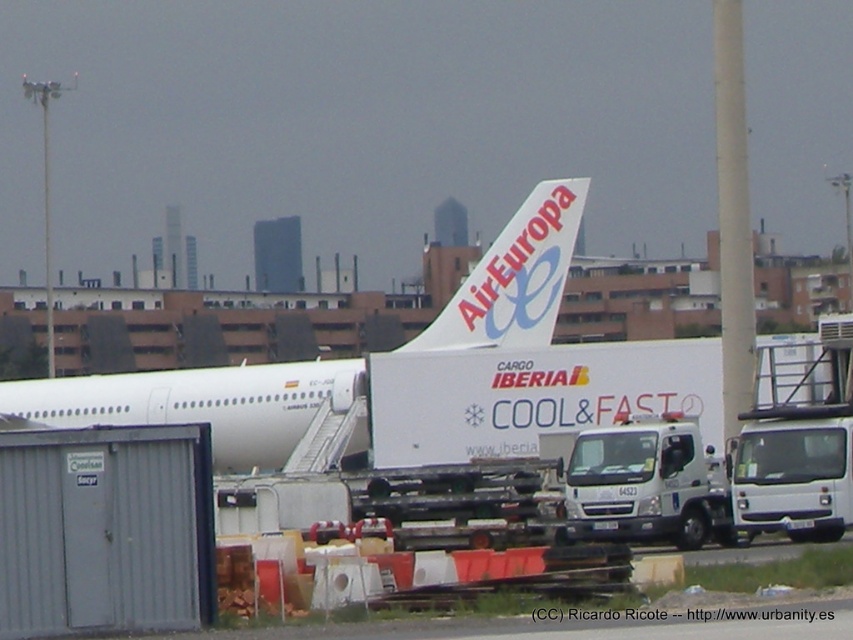
Who is higher up, white metallic truck at lower center or white matte airplane tail at center?

white matte airplane tail at center

Who is more distant from viewer, (606,476) or (563,209)?

Positioned behind is point (563,209).

In order to click on white metallic truck at lower center in this screenshot , I will do `click(645, 483)`.

Between point (498, 246) and point (653, 516), which one is positioned behind?

Point (498, 246)

Does white matte airplane at center appear on the right side of white metallic truck at lower center?

In fact, white matte airplane at center is to the left of white metallic truck at lower center.

Which is in front, point (544, 234) or point (606, 481)?

Positioned in front is point (606, 481).

Locate an element on the screen. Image resolution: width=853 pixels, height=640 pixels. white matte airplane at center is located at coordinates (198, 403).

Does white matte airplane at center have a smaller size compared to white matte airplane tail at center?

No, white matte airplane at center is not smaller than white matte airplane tail at center.

Does point (161, 403) come farther from viewer compared to point (498, 346)?

Yes, point (161, 403) is behind point (498, 346).

Is point (50, 412) closer to camera compared to point (454, 307)?

No, (50, 412) is behind (454, 307).

Locate an element on the screen. This screenshot has width=853, height=640. white matte airplane at center is located at coordinates (198, 403).